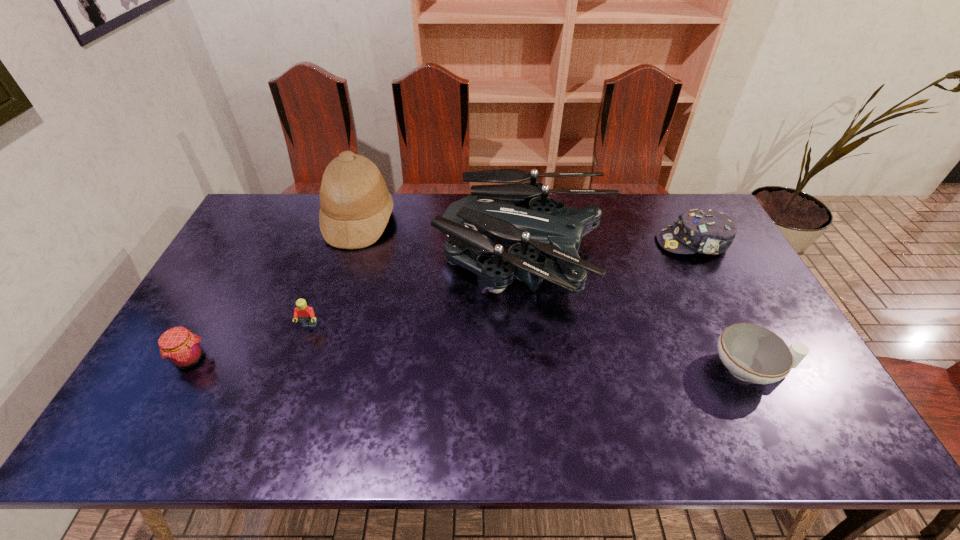
Locate an element on the screen. The image size is (960, 540). the tallest object is located at coordinates point(356,205).

The height and width of the screenshot is (540, 960). Identify the location of drone. (521, 215).

Locate an element on the screen. This screenshot has height=540, width=960. the second tallest object is located at coordinates (521, 215).

Locate an element on the screen. The image size is (960, 540). headwear is located at coordinates (705, 231).

Identify the location of Lego. This screenshot has height=540, width=960. (306, 315).

The height and width of the screenshot is (540, 960). What are the coordinates of `jam` in the screenshot? It's located at 182,349.

Where is `chinaware`? The width and height of the screenshot is (960, 540). chinaware is located at coordinates (752, 353).

Identify the location of blank area located 0.370m on the front-facing side of the hat. (499, 221).

What are the coordinates of `vacant space located 0.260m on the right of the drone` in the screenshot? It's located at (700, 265).

You are a GUI agent. You are given a task and a screenshot of the screen. Output one action in this format:
    pyautogui.click(x=<x>, y=<y>)
    Task: Click on the vacant space located on the front-facing side of the headwear
    This screenshot has height=540, width=960.
    Given the screenshot: What is the action you would take?
    pyautogui.click(x=588, y=242)